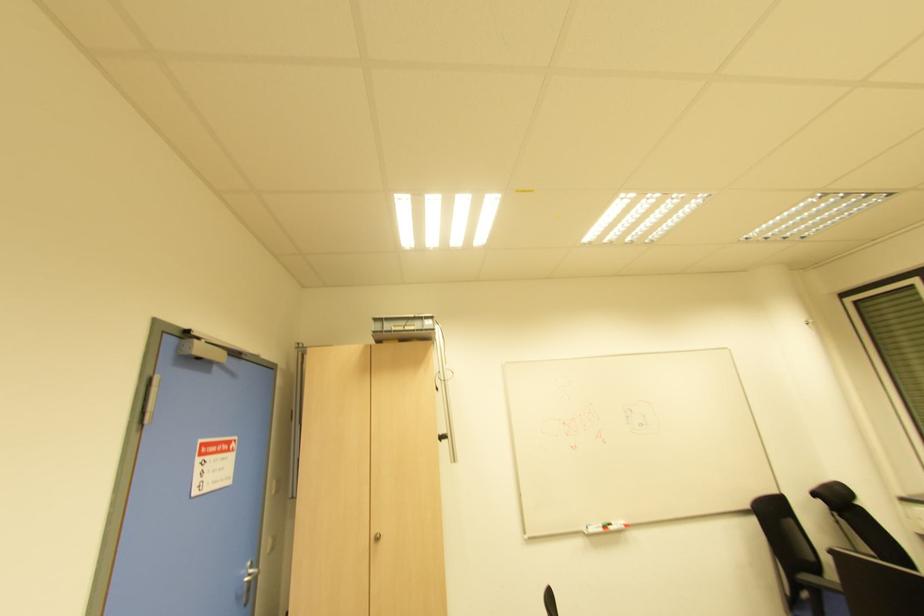
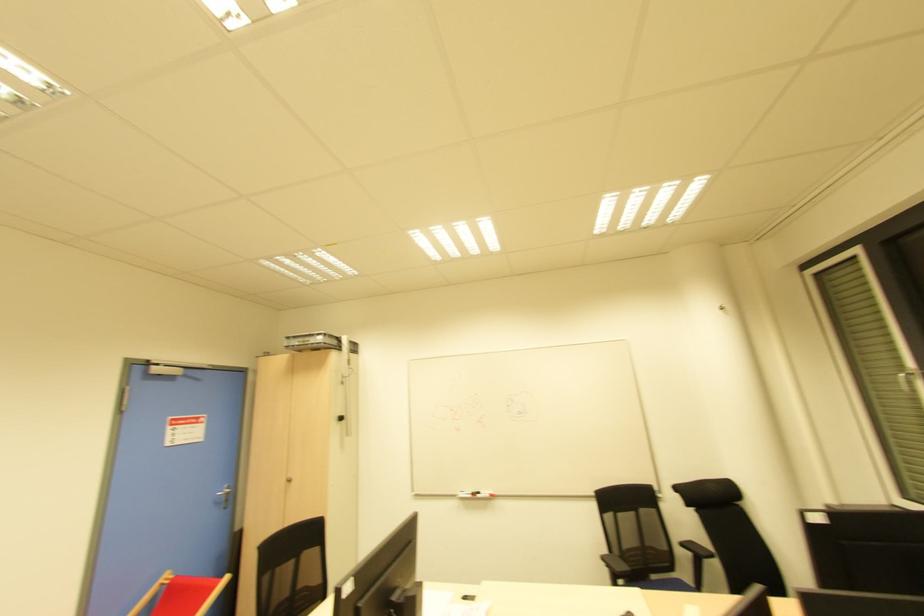
Question: The images are taken continuously from a first-person perspective. In which direction are you moving?

Choices:
 (A) Left
 (B) Right
 (C) Forward
 (D) Backward

Answer: (B)